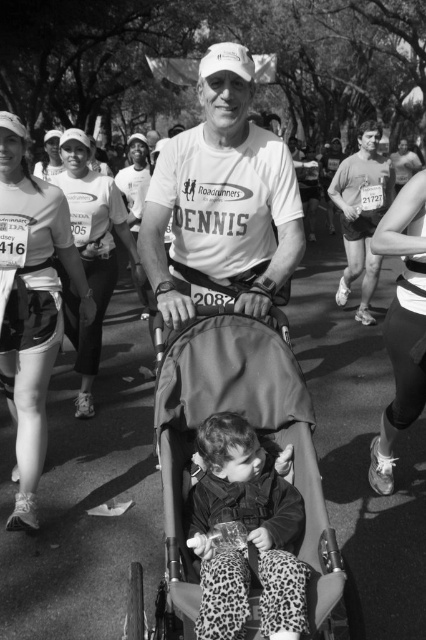
Question: Does dark gray fabric stroller at center appear over leopard print pants at center?

Choices:
 (A) no
 (B) yes

Answer: (B)

Question: Where is matte white cap at center located in relation to smooth skin man at upper right in the image?

Choices:
 (A) left
 (B) right

Answer: (A)

Question: Which is farther from the smooth skin man at upper right?

Choices:
 (A) matte white shirt at upper center
 (B) matte white cap at center

Answer: (B)

Question: Which of the following is the closest to the observer?

Choices:
 (A) (284, 611)
 (B) (126, 228)

Answer: (A)

Question: Which point is closer to the camera?

Choices:
 (A) matte white tank top at left
 (B) matte white cap at center

Answer: (B)

Question: Where is leopard print pants at center located in relation to smooth skin runner at right in the image?

Choices:
 (A) left
 (B) right

Answer: (A)